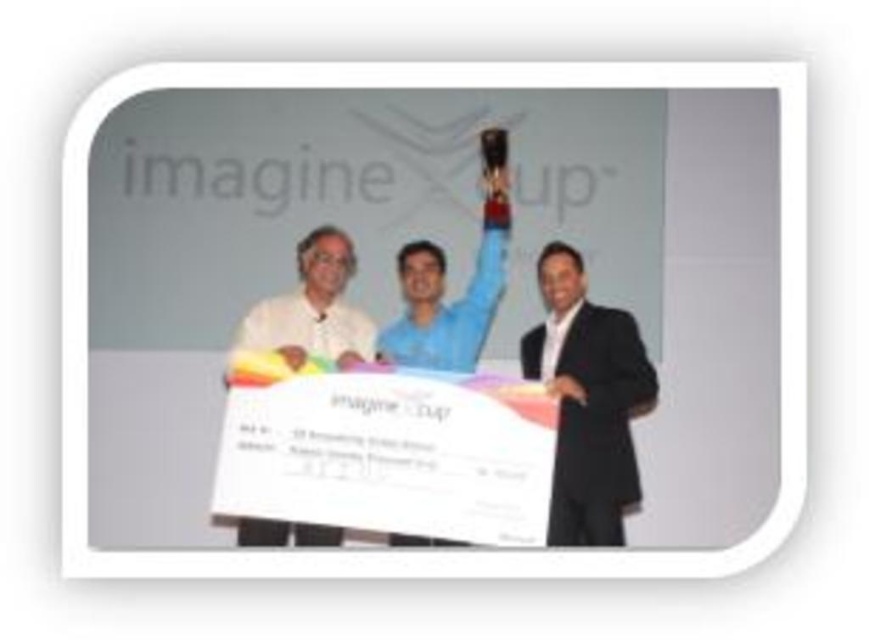
Question: Which object is farther from the camera taking this photo?

Choices:
 (A) white matte shirt at center
 (B) black suit at right

Answer: (A)

Question: Does black suit at right come in front of white matte shirt at center?

Choices:
 (A) yes
 (B) no

Answer: (A)

Question: Among these points, which one is nearest to the camera?

Choices:
 (A) (562, 269)
 (B) (322, 337)

Answer: (A)

Question: Does black suit at right appear on the left side of white matte shirt at center?

Choices:
 (A) yes
 (B) no

Answer: (B)

Question: Is black suit at right above white matte shirt at center?

Choices:
 (A) yes
 (B) no

Answer: (B)